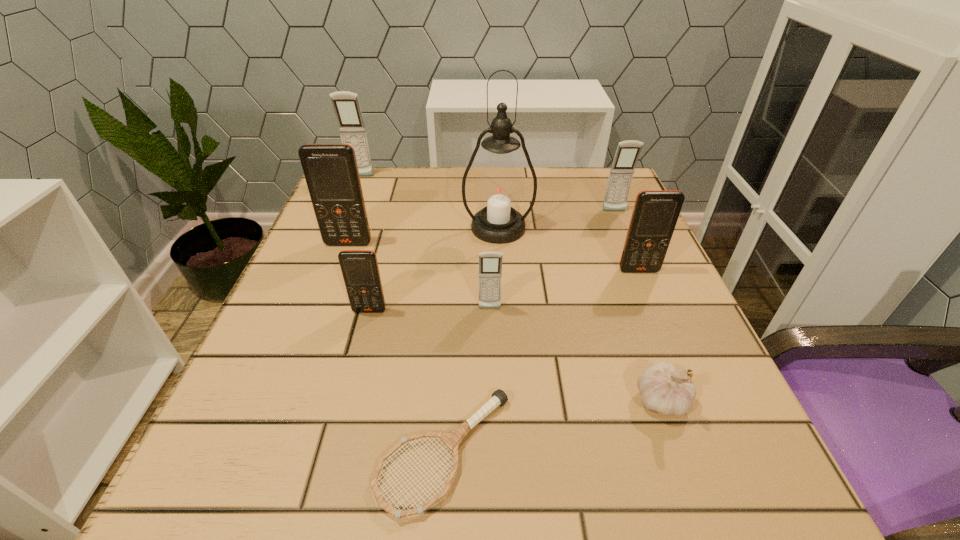
This screenshot has width=960, height=540. I want to click on empty space that is in between the fifth nearest object and the second orange cellular telephone from left to right, so click(x=504, y=291).

You are a GUI agent. You are given a task and a screenshot of the screen. Output one action in this format:
    pyautogui.click(x=<x>, y=<y>)
    Task: Click on the vacant space in between the gray tennis racket and the farthest object
    This screenshot has height=540, width=960.
    Given the screenshot: What is the action you would take?
    pyautogui.click(x=402, y=314)

Where is `empty space that is in between the nearest orange cellular telephone and the second shortest object`? The width and height of the screenshot is (960, 540). empty space that is in between the nearest orange cellular telephone and the second shortest object is located at coordinates (516, 355).

Locate an element on the screen. Image resolution: width=960 pixels, height=540 pixels. object that is the fifth nearest to the rightmost gray cellular telephone is located at coordinates (331, 172).

Identify which object is the third closest to the rightmost gray cellular telephone. Please provide its 2D coordinates. Your answer should be formatted as a tuple, i.e. [(x, y)], where the tuple contains the x and y coordinates of a point satisfying the conditions above.

[(490, 263)]

Identify the location of cellular telephone that is the fifth closest one to the tennis racket. (627, 153).

Identify which cellular telephone is the third nearest to the nearest gray cellular telephone. Please provide its 2D coordinates. Your answer should be formatted as a tuple, i.e. [(x, y)], where the tuple contains the x and y coordinates of a point satisfying the conditions above.

[(331, 172)]

Locate which gray cellular telephone ranks third in proximity to the eighth tallest object. Please provide its 2D coordinates. Your answer should be formatted as a tuple, i.e. [(x, y)], where the tuple contains the x and y coordinates of a point satisfying the conditions above.

[(346, 105)]

Identify which gray cellular telephone is the closest to the second nearest gray cellular telephone. Please provide its 2D coordinates. Your answer should be formatted as a tuple, i.e. [(x, y)], where the tuple contains the x and y coordinates of a point satisfying the conditions above.

[(490, 263)]

Identify which orange cellular telephone is located as the third nearest to the tennis racket. Please provide its 2D coordinates. Your answer should be formatted as a tuple, i.e. [(x, y)], where the tuple contains the x and y coordinates of a point satisfying the conditions above.

[(331, 172)]